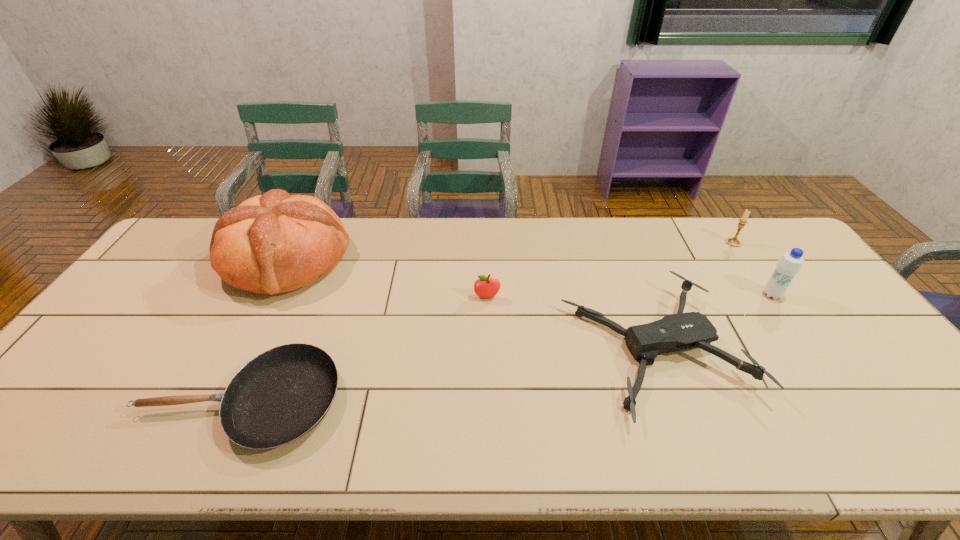
Locate an element on the screen. The height and width of the screenshot is (540, 960). the tallest object is located at coordinates (273, 243).

This screenshot has width=960, height=540. I want to click on the second tallest object, so click(x=790, y=264).

The height and width of the screenshot is (540, 960). In order to click on the third tallest object in this screenshot , I will do `click(734, 242)`.

The width and height of the screenshot is (960, 540). Identify the location of the fourth object from right to left. (485, 287).

In order to click on apple in this screenshot , I will do `click(485, 287)`.

You are a GUI agent. You are given a task and a screenshot of the screen. Output one action in this format:
    pyautogui.click(x=<x>, y=<y>)
    Task: Click on the drone
    This screenshot has width=960, height=540.
    Given the screenshot: What is the action you would take?
    pyautogui.click(x=675, y=332)

Find the location of a particular element. Image resolution: width=960 pixels, height=540 pixels. the second shortest object is located at coordinates (675, 332).

At what (x,y) coordinates should I click in order to perform the action: click on the shortest object. Please return your answer as a coordinate pair (x, y). This screenshot has width=960, height=540. Looking at the image, I should click on (280, 395).

Identify the location of free space located on the left of the bread. The image size is (960, 540). (204, 260).

Locate an element on the screen. vacant area situated 0.370m on the left of the water bottle is located at coordinates 636,295.